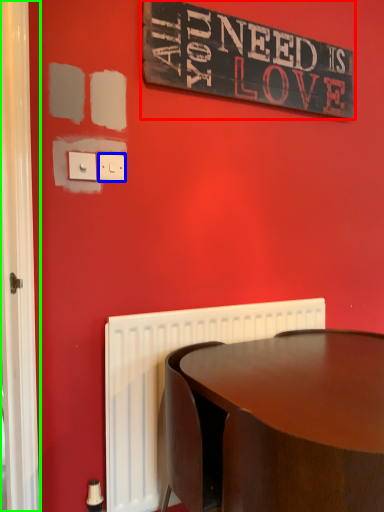
Question: Which is farther away from bulletin board (highlighted by a red box)? electric outlet (highlighted by a blue box) or screen door (highlighted by a green box)?

Choices:
 (A) electric outlet
 (B) screen door

Answer: (B)